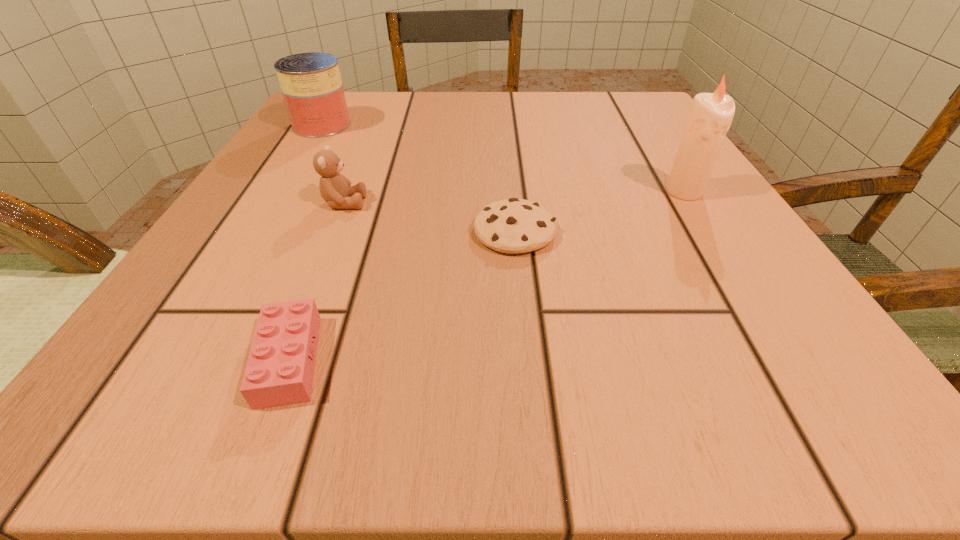
The width and height of the screenshot is (960, 540). In order to click on free space between the teddy bear and the Lego in this screenshot , I will do `click(317, 281)`.

Where is `vacant area between the candle and the can`? Image resolution: width=960 pixels, height=540 pixels. vacant area between the candle and the can is located at coordinates (503, 158).

You are a GUI agent. You are given a task and a screenshot of the screen. Output one action in this format:
    pyautogui.click(x=<x>, y=<y>)
    Task: Click on the free space between the nearest object and the candle
    The image size is (960, 540).
    Given the screenshot: What is the action you would take?
    pyautogui.click(x=487, y=276)

The width and height of the screenshot is (960, 540). I want to click on object that is the closest one to the third shortest object, so click(x=514, y=225).

Where is `the closest object relative to the third shortest object`? The height and width of the screenshot is (540, 960). the closest object relative to the third shortest object is located at coordinates (514, 225).

Identify the location of free region that satisfies the following two spatial constraints: 1. on the back side of the second object from right to left; 2. on the left side of the tallest object. The width and height of the screenshot is (960, 540). (511, 192).

Image resolution: width=960 pixels, height=540 pixels. I want to click on free space in the image that satisfies the following two spatial constraints: 1. on the front side of the leftmost object; 2. on the right side of the cookie, so click(x=257, y=231).

Identify the location of free point that satisfies the following two spatial constraints: 1. on the face of the third shortest object; 2. on the back side of the nearest object. Image resolution: width=960 pixels, height=540 pixels. (281, 360).

This screenshot has height=540, width=960. I want to click on free location that satisfies the following two spatial constraints: 1. on the face of the fourth object from left to right; 2. on the left side of the third shortest object, so click(x=332, y=231).